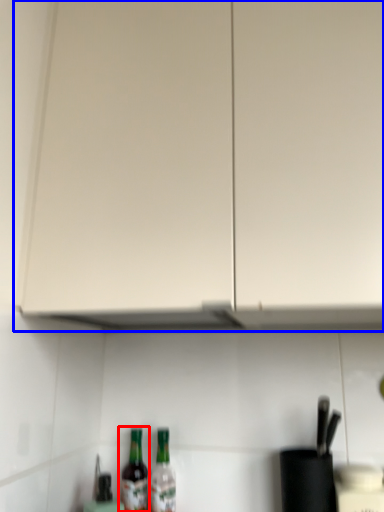
Question: Among these objects, which one is farthest to the camera, bottle (highlighted by a red box) or cabinetry (highlighted by a blue box)?

Choices:
 (A) bottle
 (B) cabinetry

Answer: (A)